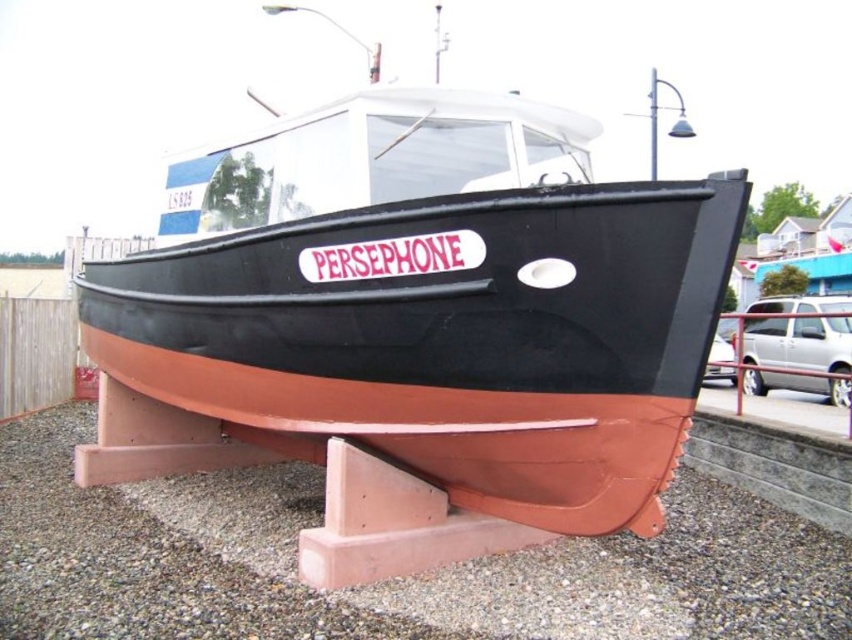
Question: Which point is closer to the camera taking this photo?

Choices:
 (A) (724, 579)
 (B) (684, 234)

Answer: (B)

Question: Which of the following is the farthest from the observer?

Choices:
 (A) brown matte boat at center
 (B) brown gravel at lower center

Answer: (A)

Question: Where is brown matte boat at center located in relation to brown gravel at lower center in the image?

Choices:
 (A) left
 (B) right

Answer: (A)

Question: Is brown matte boat at center below brown gravel at lower center?

Choices:
 (A) no
 (B) yes

Answer: (A)

Question: Is brown matte boat at center bigger than brown gravel at lower center?

Choices:
 (A) yes
 (B) no

Answer: (A)